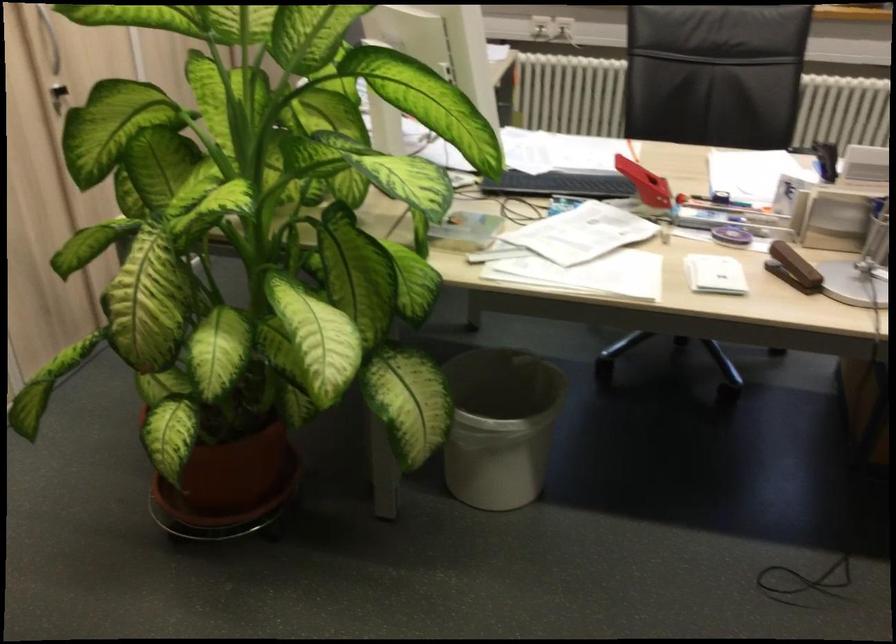
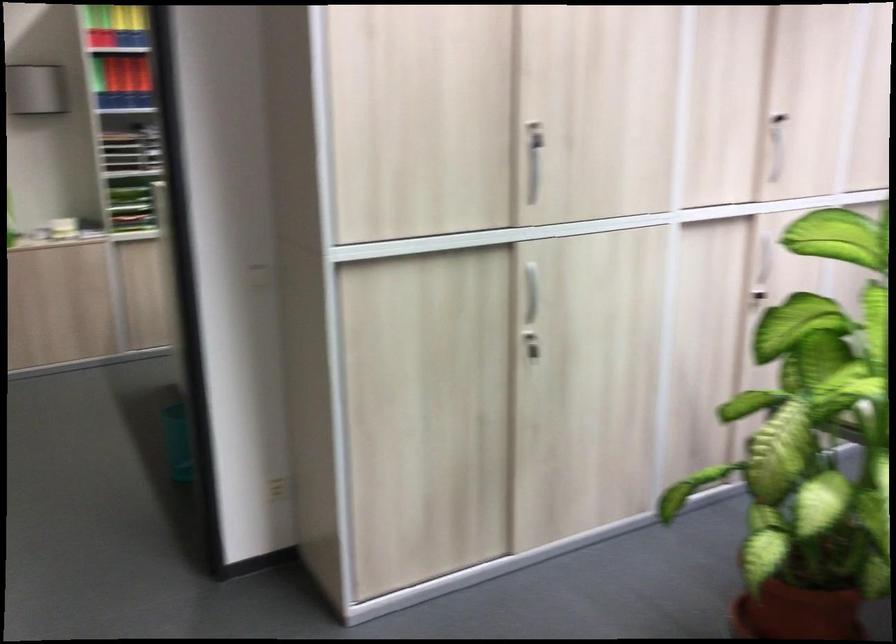
Find the pixel in the second image that matches [71,95] in the first image.

(759, 299)